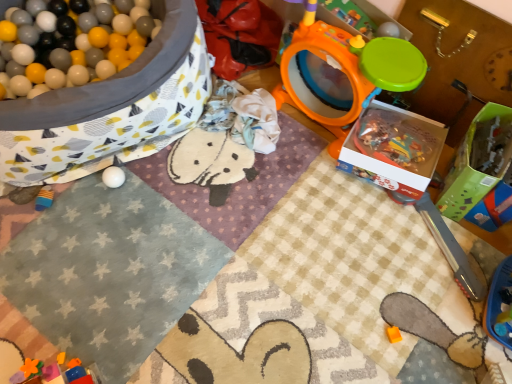
Question: Are orange matte toy at lower center, the second toy when ordered from bottom to top, and rubberized plastic blocks at lower left, the 2th toy from the left, located far from each other?

Choices:
 (A) no
 (B) yes

Answer: (A)

Question: Is orange matte toy at lower center, acting as the 5th toy starting from the left, bigger than rubberized plastic blocks at lower left, positioned as the first toy in bottom-to-top order?

Choices:
 (A) yes
 (B) no

Answer: (B)

Question: Can you confirm if orange matte toy at lower center, acting as the 5th toy starting from the left, is smaller than rubberized plastic blocks at lower left, marked as the sixth toy in a top-to-bottom arrangement?

Choices:
 (A) no
 (B) yes

Answer: (B)

Question: From the image's perspective, would you say orange matte toy at lower center, acting as the 5th toy starting from the left, is shown under rubberized plastic blocks at lower left, the 2th toy from the left?

Choices:
 (A) yes
 (B) no

Answer: (B)

Question: Is orange matte toy at lower center, the 5th toy when ordered from top to bottom, outside rubberized plastic blocks at lower left, which ranks as the fifth toy in right-to-left order?

Choices:
 (A) no
 (B) yes

Answer: (B)

Question: From the image's perspective, is white textured blanket at upper left above or below white matte ball at lower left, which is counted as the fourth toy, starting from the right?

Choices:
 (A) above
 (B) below

Answer: (B)

Question: Is white textured blanket at upper left bigger or smaller than white matte ball at lower left, the third toy viewed from the left?

Choices:
 (A) small
 (B) big

Answer: (B)

Question: In the image, is white textured blanket at upper left positioned in front of or behind white matte ball at lower left, the third toy viewed from the left?

Choices:
 (A) behind
 (B) front

Answer: (B)

Question: Considering the positions of point click(x=51, y=304) and point click(x=114, y=177), is point click(x=51, y=304) closer or farther from the camera than point click(x=114, y=177)?

Choices:
 (A) closer
 (B) farther

Answer: (A)

Question: Is point (389, 329) closer or farther from the camera than point (485, 125)?

Choices:
 (A) farther
 (B) closer

Answer: (B)

Question: In terms of width, does orange matte toy at lower center, acting as the 5th toy starting from the left, look wider or thinner when compared to green cardboard box at right, acting as the second box starting from the left?

Choices:
 (A) wide
 (B) thin

Answer: (B)

Question: Is orange matte toy at lower center, which ranks as the second toy in right-to-left order, to the left or to the right of green cardboard box at right, which appears as the first box when viewed from the right, in the image?

Choices:
 (A) left
 (B) right

Answer: (A)

Question: From the image's perspective, is orange matte toy at lower center, acting as the 5th toy starting from the left, above or below green cardboard box at right, acting as the second box starting from the left?

Choices:
 (A) above
 (B) below

Answer: (B)

Question: Would you say orange plastic drum at upper right, arranged as the 4th toy when viewed from the left, is to the left or to the right of white matte ball at lower left, which is the fourth toy in bottom-to-top order, in the picture?

Choices:
 (A) right
 (B) left

Answer: (A)

Question: Considering the positions of orange plastic drum at upper right, arranged as the 4th toy when viewed from the left, and white matte ball at lower left, the third toy viewed from the left, in the image, is orange plastic drum at upper right, arranged as the 4th toy when viewed from the left, bigger or smaller than white matte ball at lower left, the third toy viewed from the left,?

Choices:
 (A) small
 (B) big

Answer: (B)